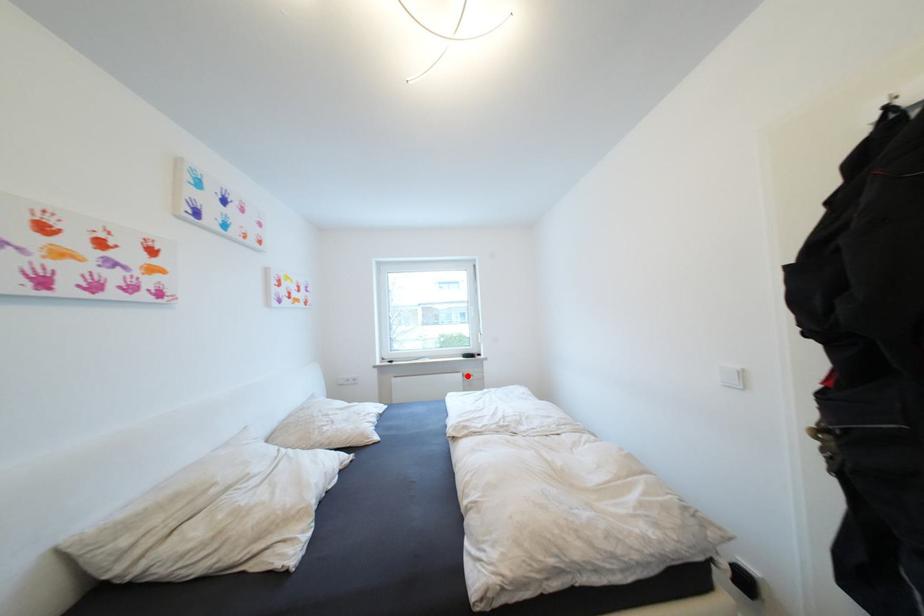
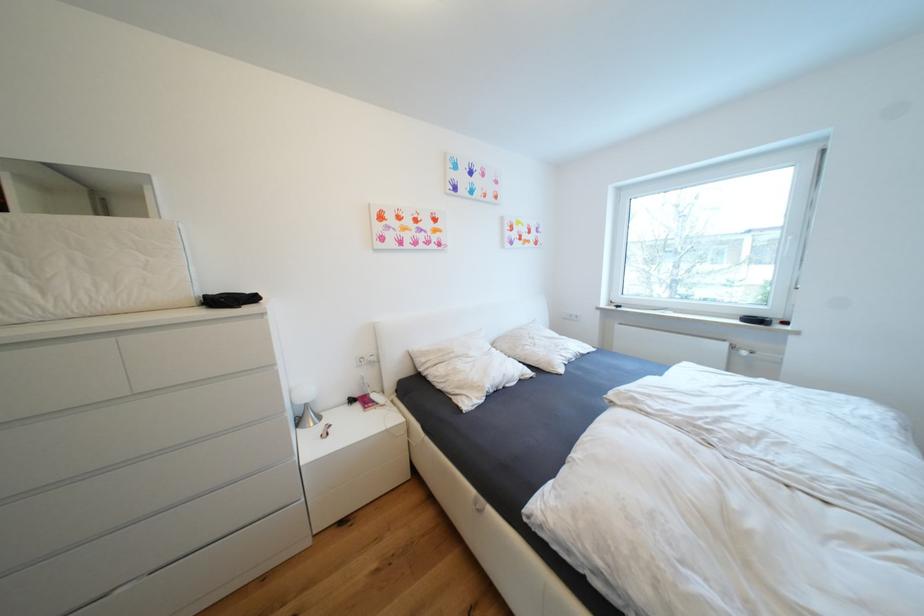
In the second image, find the point that corresponds to the highlighted location in the first image.

(733, 346)